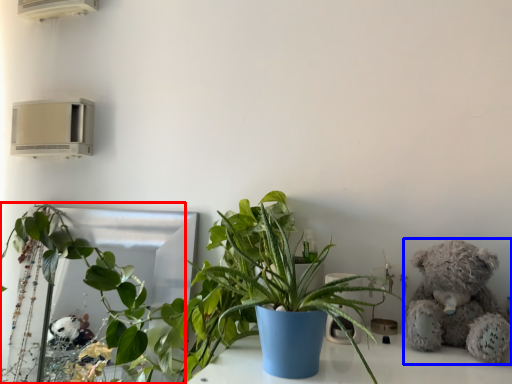
Question: Which of the following is the farthest to the observer, houseplant (highlighted by a red box) or teddy bear (highlighted by a blue box)?

Choices:
 (A) houseplant
 (B) teddy bear

Answer: (A)